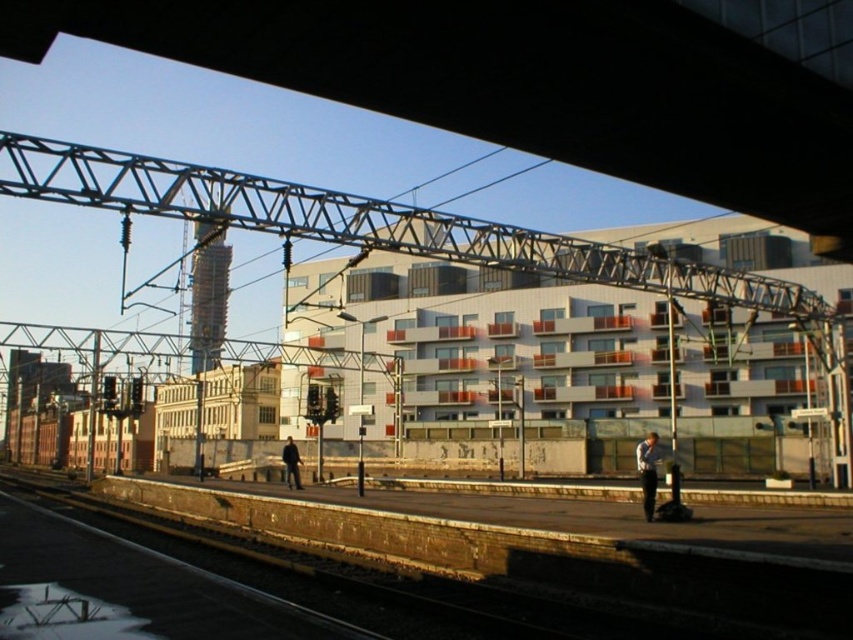
Question: Which object appears farthest from the camera in this image?

Choices:
 (A) dark blue jeans at center
 (B) light blue shirt at lower right

Answer: (A)

Question: Can you confirm if light blue shirt at lower right is positioned to the right of dark blue jeans at center?

Choices:
 (A) no
 (B) yes

Answer: (B)

Question: Is light blue shirt at lower right positioned before dark blue jeans at center?

Choices:
 (A) no
 (B) yes

Answer: (B)

Question: Can you confirm if light blue shirt at lower right is thinner than dark blue jeans at center?

Choices:
 (A) no
 (B) yes

Answer: (A)

Question: Which point is closer to the camera taking this photo?

Choices:
 (A) (651, 481)
 (B) (297, 488)

Answer: (A)